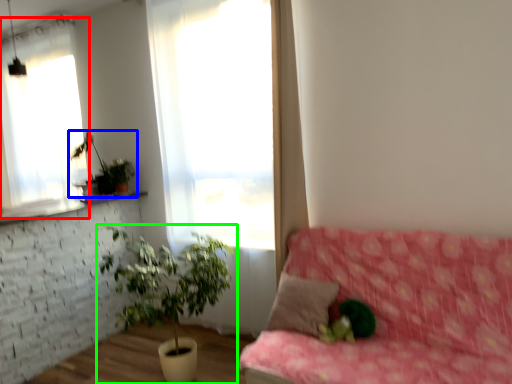
Question: Which is nearer to the window (highlighted by a red box)? houseplant (highlighted by a blue box) or houseplant (highlighted by a green box).

Choices:
 (A) houseplant
 (B) houseplant

Answer: (A)